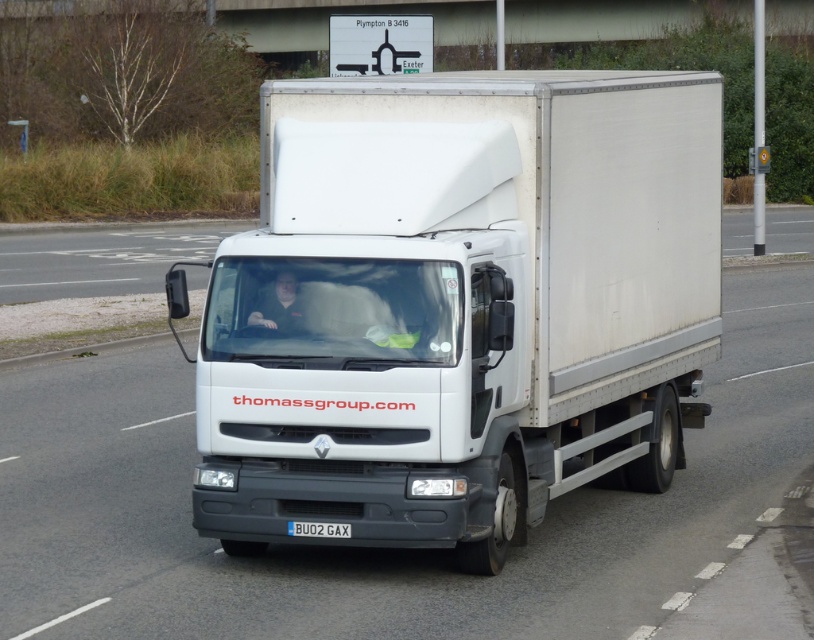
Can you confirm if white matte truck at center is shorter than black metal license plate at center?

No.

Image resolution: width=814 pixels, height=640 pixels. What do you see at coordinates (458, 305) in the screenshot? I see `white matte truck at center` at bounding box center [458, 305].

Describe the element at coordinates (458, 305) in the screenshot. I see `white matte truck at center` at that location.

This screenshot has width=814, height=640. I want to click on white matte truck at center, so click(458, 305).

Can you confirm if white glossy truck at center is taller than black metal license plate at center?

Yes, white glossy truck at center is taller than black metal license plate at center.

Consider the image. Who is positioned more to the left, white glossy truck at center or black metal license plate at center?

black metal license plate at center is more to the left.

You are a GUI agent. You are given a task and a screenshot of the screen. Output one action in this format:
    pyautogui.click(x=<x>, y=<y>)
    Task: Click on the white glossy truck at center
    
    Given the screenshot: What is the action you would take?
    pyautogui.click(x=377, y=548)

Can you confirm if white matte truck at center is positioned to the left of white glossy truck at center?

Yes, white matte truck at center is to the left of white glossy truck at center.

I want to click on white matte truck at center, so click(458, 305).